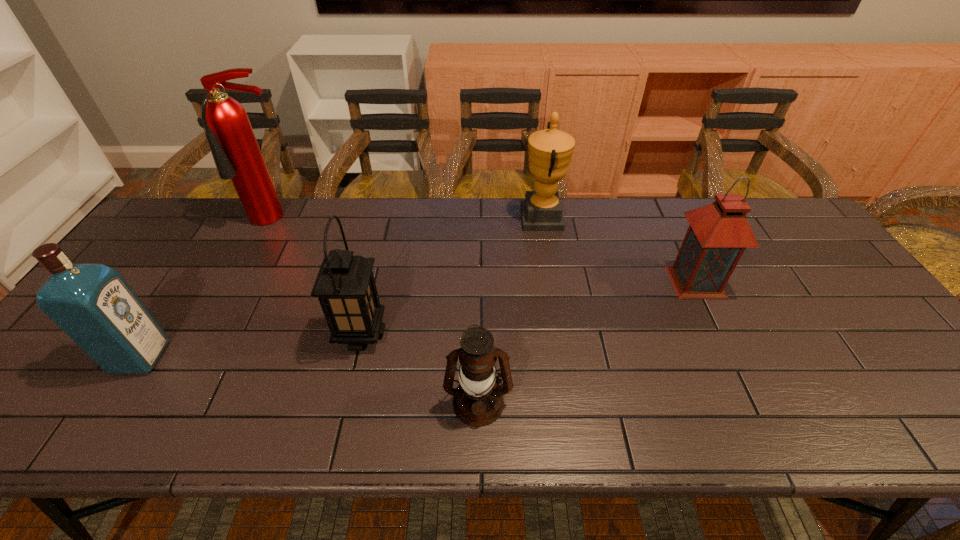
Find the location of a particular element. The width and height of the screenshot is (960, 540). fire extinguisher is located at coordinates (236, 153).

Where is `the tallest object`? This screenshot has width=960, height=540. the tallest object is located at coordinates (236, 153).

Identify the location of award. (550, 150).

Image resolution: width=960 pixels, height=540 pixels. Find the location of `the second farthest lantern`. the second farthest lantern is located at coordinates (345, 286).

Locate an element on the screen. The image size is (960, 540). the fourth object from right to left is located at coordinates (345, 286).

This screenshot has width=960, height=540. What are the coordinates of `the leftmost object` in the screenshot? It's located at (92, 303).

Where is `the fourth nearest object`? the fourth nearest object is located at coordinates (718, 234).

At what (x,y) coordinates should I click in order to perform the action: click on the rightmost object. Please return your answer as a coordinate pair (x, y). Looking at the image, I should click on (718, 234).

Locate an element on the screen. This screenshot has height=540, width=960. the nearest lantern is located at coordinates (478, 401).

Identify the location of the fourth object from left to right. (478, 401).